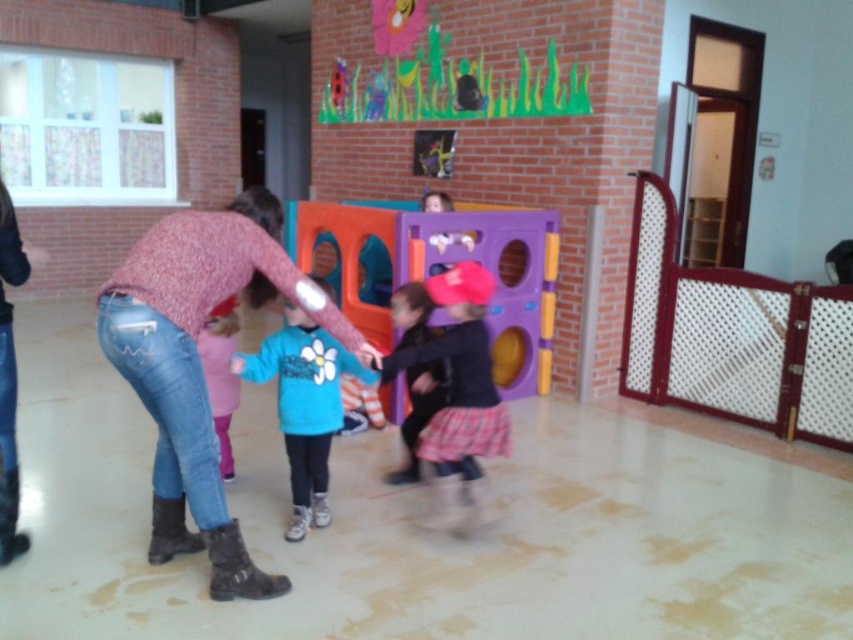
Question: Which object is farther from the camera taking this photo?

Choices:
 (A) blue fleece jacket at center
 (B) jeans at center
 (C) pink matte cap at center
 (D) pink fabric pants at lower left

Answer: (D)

Question: Which of these objects is positioned farthest from the pink fabric pants at lower left?

Choices:
 (A) jeans at center
 (B) pink matte cap at center
 (C) blue fleece jacket at center

Answer: (B)

Question: Is jeans at center above blue fleece jacket at center?

Choices:
 (A) no
 (B) yes

Answer: (B)

Question: Can you confirm if pink matte cap at center is wider than pink fabric pants at lower left?

Choices:
 (A) no
 (B) yes

Answer: (B)

Question: Can you confirm if blue fleece jacket at center is wider than pink fabric pants at lower left?

Choices:
 (A) no
 (B) yes

Answer: (B)

Question: Which object is closer to the camera taking this photo?

Choices:
 (A) pink fabric pants at lower left
 (B) blue fleece jacket at center
 (C) jeans at center

Answer: (C)